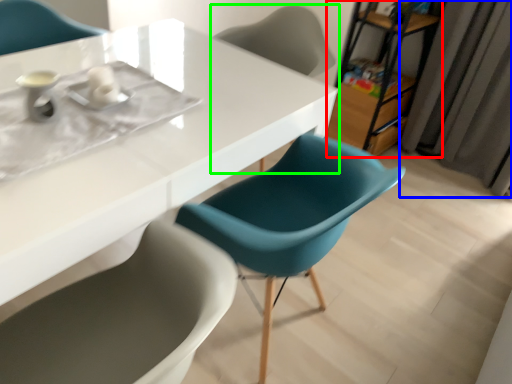
Question: Based on their relative distances, which object is farther from bookshelf (highlighted by a red box)? Choose from curtain (highlighted by a blue box) and chair (highlighted by a green box).

Choices:
 (A) curtain
 (B) chair

Answer: (B)